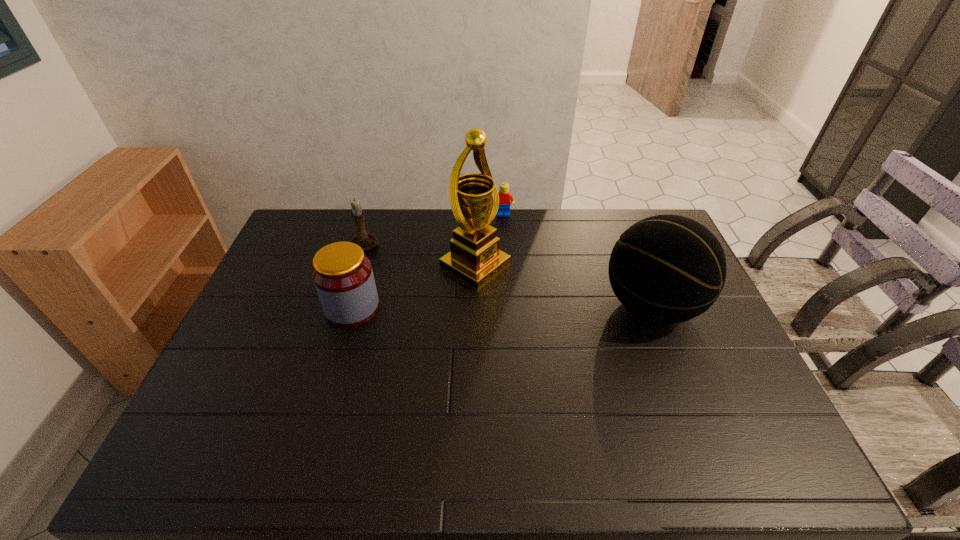
This screenshot has height=540, width=960. In order to click on Lego that is at the far edge in this screenshot , I will do `click(505, 196)`.

At what (x,y) coordinates should I click in order to perform the action: click on object positioned at the right edge. Please return your answer as a coordinate pair (x, y). This screenshot has width=960, height=540. Looking at the image, I should click on (668, 269).

Locate an element on the screen. This screenshot has height=540, width=960. vacant space at the far edge of the desktop is located at coordinates [546, 242].

In the image, there is a desktop. Where is `free space at the near edge`? Image resolution: width=960 pixels, height=540 pixels. free space at the near edge is located at coordinates (605, 421).

At what (x,y) coordinates should I click in order to perform the action: click on free space at the left edge of the desktop. Please return your answer as a coordinate pair (x, y). The width and height of the screenshot is (960, 540). Looking at the image, I should click on pos(305,274).

In order to click on free space at the right edge of the desktop in this screenshot , I will do `click(703, 382)`.

The image size is (960, 540). I want to click on free space between the candle holder and the fourth shortest object, so click(x=509, y=275).

You are a GUI agent. You are given a task and a screenshot of the screen. Output one action in this format:
    pyautogui.click(x=<x>, y=<y>)
    Task: Click on the free space between the shortest object and the second tallest object
    The width and height of the screenshot is (960, 540).
    Given the screenshot: What is the action you would take?
    pyautogui.click(x=577, y=260)

Where is `free space that is in between the tallest object and the second tallest object`? free space that is in between the tallest object and the second tallest object is located at coordinates (564, 286).

Where is `vacant space that's between the candle holder and the farthest object`? Image resolution: width=960 pixels, height=540 pixels. vacant space that's between the candle holder and the farthest object is located at coordinates (435, 230).